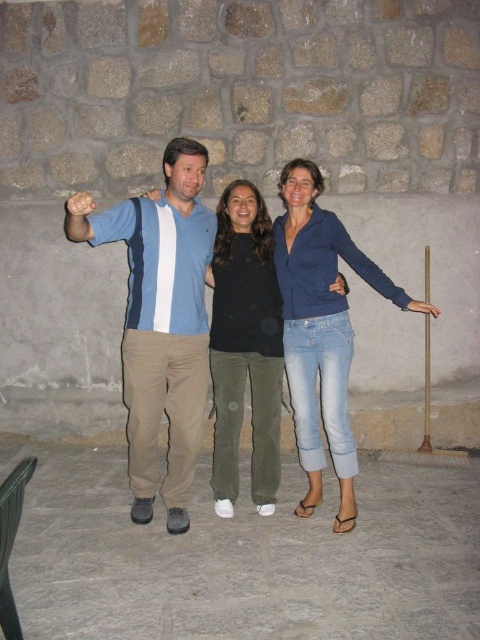
Consider the image. Between blue smooth shirt at right and blue fabric shirt at left, which one has more height?

Standing taller between the two is blue smooth shirt at right.

Does blue smooth shirt at right have a larger size compared to blue fabric shirt at left?

Correct, blue smooth shirt at right is larger in size than blue fabric shirt at left.

Find the location of a particular element. blue smooth shirt at right is located at coordinates (372, 269).

Find the location of a particular element. Image resolution: width=480 pixels, height=640 pixels. blue smooth shirt at right is located at coordinates click(x=372, y=269).

Looking at this image, can you confirm if smooth stone floor at center is positioned to the left of black matte shirt at center?

Yes, smooth stone floor at center is to the left of black matte shirt at center.

Is the position of smooth stone floor at center more distant than that of black matte shirt at center?

No, smooth stone floor at center is in front of black matte shirt at center.

At what (x,y) coordinates should I click in order to perform the action: click on smooth stone floor at center. Please return your answer as a coordinate pair (x, y). The height and width of the screenshot is (640, 480). Looking at the image, I should click on (244, 557).

Does blue striped shirt at center have a lesser width compared to black matte shirt at center?

No.

Identify the location of blue striped shirt at center. The image size is (480, 640). (160, 323).

Where is `blue striped shirt at center`? blue striped shirt at center is located at coordinates (160, 323).